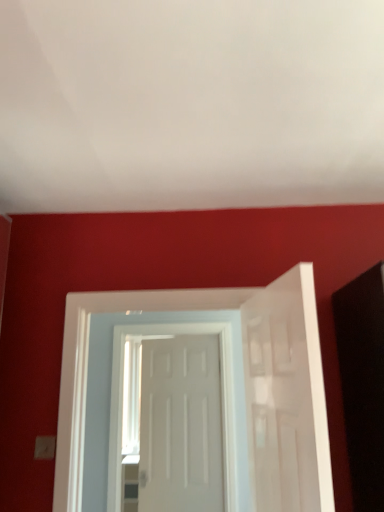
Question: From the image's perspective, relative to white matte door at center, marked as the 3th door in a front-to-back arrangement, is white glossy door at center, which is counted as the 2th door, starting from the front, above or below?

Choices:
 (A) above
 (B) below

Answer: (A)

Question: Does point (152, 505) appear closer or farther from the camera than point (187, 451)?

Choices:
 (A) farther
 (B) closer

Answer: (A)

Question: Which is nearer to the white glossy door at center, which is counted as the 2th door, starting from the front?

Choices:
 (A) white matte door at right, the 3th door when ordered from back to front
 (B) white matte door at center, the 1th door viewed from the back

Answer: (B)

Question: Which object is positioned closest to the white glossy door at center, which is counted as the 2th door, starting from the front?

Choices:
 (A) white matte door at center, marked as the 3th door in a front-to-back arrangement
 (B) white matte door at right, marked as the first door in a front-to-back arrangement

Answer: (A)